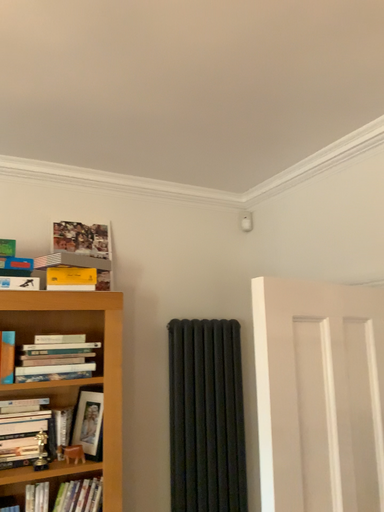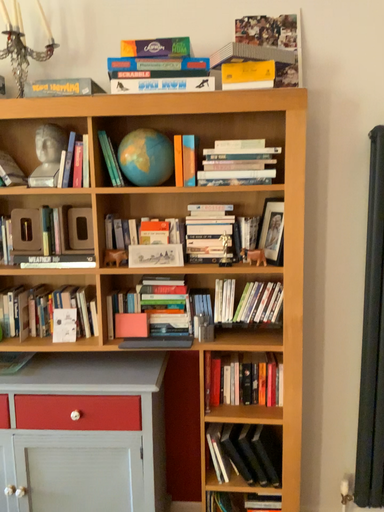
Question: Which way did the camera rotate in the video?

Choices:
 (A) rotated right
 (B) rotated left

Answer: (B)